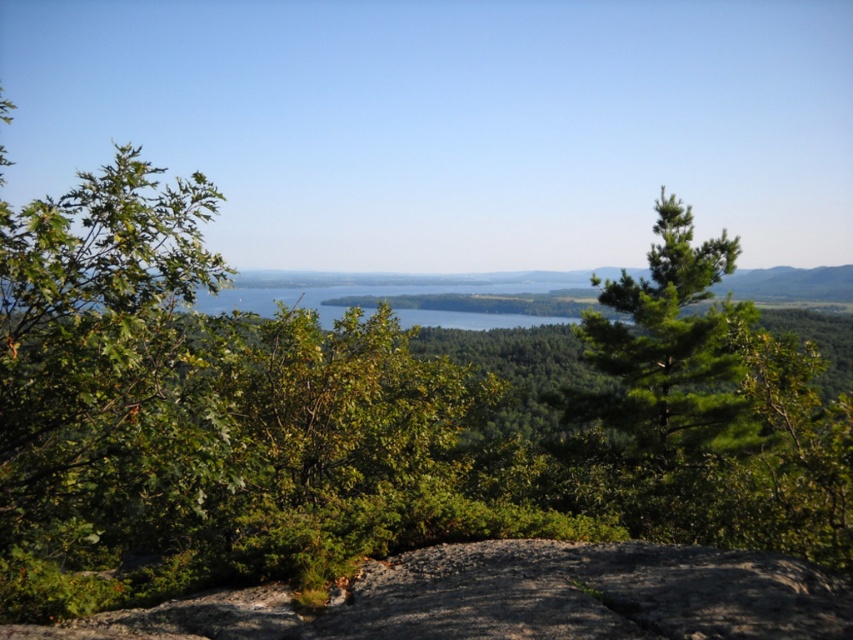
Question: Which of the following is the closest to the observer?

Choices:
 (A) (653, 627)
 (B) (692, 449)

Answer: (A)

Question: Does gray rough rock at center appear on the left side of green needle-like at center?

Choices:
 (A) yes
 (B) no

Answer: (A)

Question: Does gray rough rock at center appear over green needle-like at center?

Choices:
 (A) no
 (B) yes

Answer: (A)

Question: Is gray rough rock at center to the right of green needle-like at center from the viewer's perspective?

Choices:
 (A) no
 (B) yes

Answer: (A)